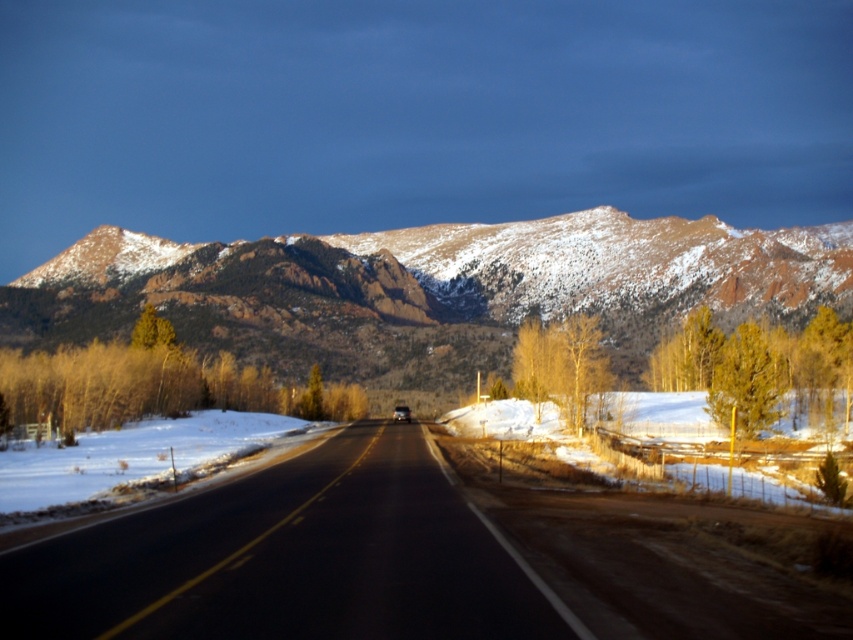
Question: Which object is closer to the camera taking this photo?

Choices:
 (A) black asphalt road at center
 (B) metallic silver car at center

Answer: (A)

Question: Does snow-covered rock at upper center have a greater width compared to metallic silver car at center?

Choices:
 (A) yes
 (B) no

Answer: (A)

Question: Can you confirm if snow-covered rock at upper center is positioned below metallic silver car at center?

Choices:
 (A) yes
 (B) no

Answer: (B)

Question: Which of these objects is positioned closest to the metallic silver car at center?

Choices:
 (A) black asphalt road at center
 (B) snow-covered rock at upper center

Answer: (A)

Question: Which is farther from the snow-covered rock at upper center?

Choices:
 (A) black asphalt road at center
 (B) metallic silver car at center

Answer: (A)

Question: Does black asphalt road at center appear on the left side of metallic silver car at center?

Choices:
 (A) no
 (B) yes

Answer: (A)